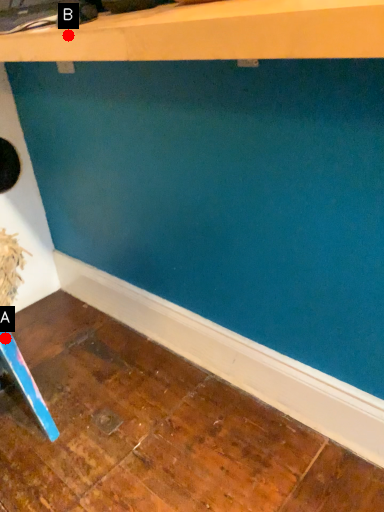
Question: Two points are circled on the image, labeled by A and B beside each circle. Which of the following is the closest to the observer?

Choices:
 (A) A is closer
 (B) B is closer

Answer: (B)